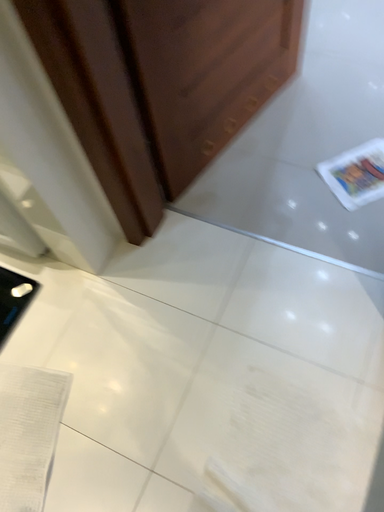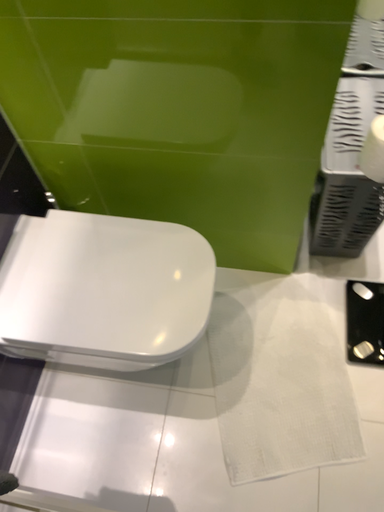
Question: Which way did the camera rotate in the video?

Choices:
 (A) rotated right
 (B) rotated left

Answer: (B)